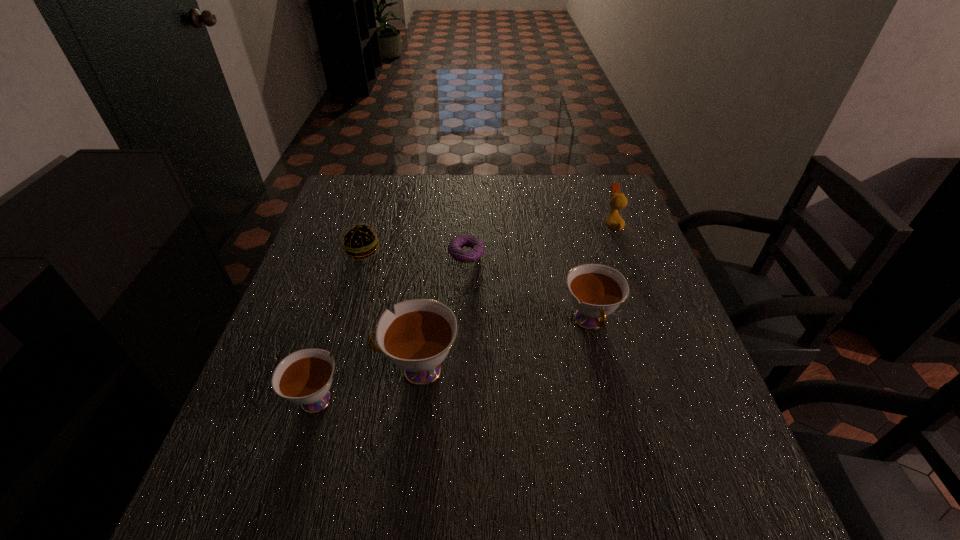
To make them evenly spaced by inserting another teacup among them, please locate a vacant spot for this new teacup. Please provide its 2D coordinates. Your answer should be formatted as a tuple, i.e. [(x, y)], where the tuple contains the x and y coordinates of a point satisfying the conditions above.

[(508, 345)]